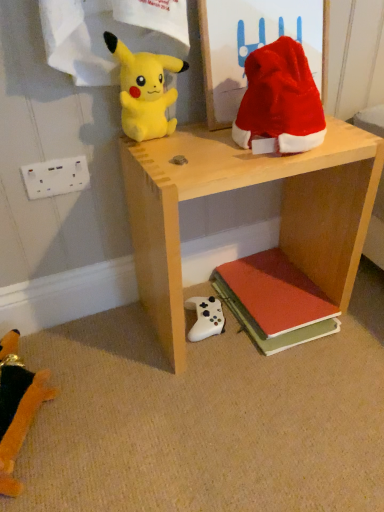
Question: Can you confirm if white matte game controller at lower center, the 3th toy positioned from the left, is thinner than white plastic/socket at lower left?

Choices:
 (A) no
 (B) yes

Answer: (A)

Question: From the image's perspective, would you say white matte game controller at lower center, placed as the third toy when sorted from top to bottom, is positioned over white plastic/socket at lower left?

Choices:
 (A) yes
 (B) no

Answer: (B)

Question: Is there a large distance between white matte game controller at lower center, the 3th toy positioned from the left, and white plastic/socket at lower left?

Choices:
 (A) yes
 (B) no

Answer: (B)

Question: Does white matte game controller at lower center, placed as the third toy when sorted from top to bottom, turn towards white plastic/socket at lower left?

Choices:
 (A) yes
 (B) no

Answer: (B)

Question: Is white matte game controller at lower center, positioned as the second toy in bottom-to-top order, positioned before white plastic/socket at lower left?

Choices:
 (A) yes
 (B) no

Answer: (B)

Question: From their relative heights in the image, would you say yellow plush toy at upper left, the second toy when ordered from left to right, is taller or shorter than red matte book at lower right?

Choices:
 (A) short
 (B) tall

Answer: (B)

Question: From the image's perspective, is yellow plush toy at upper left, which is counted as the first toy, starting from the top, above or below red matte book at lower right?

Choices:
 (A) below
 (B) above

Answer: (B)

Question: From a real-world perspective, is yellow plush toy at upper left, which is counted as the first toy, starting from the top, above or below red matte book at lower right?

Choices:
 (A) below
 (B) above

Answer: (B)

Question: Does point pos(155,109) appear closer or farther from the camera than point pos(256,309)?

Choices:
 (A) farther
 (B) closer

Answer: (B)

Question: In the image, is velvet red santa hat at upper right, the first toy in the right-to-left sequence, on the left side or the right side of red matte book at lower right?

Choices:
 (A) left
 (B) right

Answer: (A)

Question: In terms of width, does velvet red santa hat at upper right, which appears as the fourth toy when viewed from the left, look wider or thinner when compared to red matte book at lower right?

Choices:
 (A) wide
 (B) thin

Answer: (B)

Question: From a real-world perspective, is velvet red santa hat at upper right, which ranks as the second toy in top-to-bottom order, above or below red matte book at lower right?

Choices:
 (A) below
 (B) above

Answer: (B)

Question: Is velvet red santa hat at upper right, which ranks as the second toy in top-to-bottom order, in front of or behind red matte book at lower right in the image?

Choices:
 (A) behind
 (B) front

Answer: (B)

Question: From a real-world perspective, relative to velvet orange stuffed toy at lower left, arranged as the first toy when viewed from the left, is velvet red santa hat at upper right, which appears as the fourth toy when viewed from the left, vertically above or below?

Choices:
 (A) below
 (B) above

Answer: (B)

Question: Considering the positions of point (307, 112) and point (3, 384), is point (307, 112) closer or farther from the camera than point (3, 384)?

Choices:
 (A) farther
 (B) closer

Answer: (B)